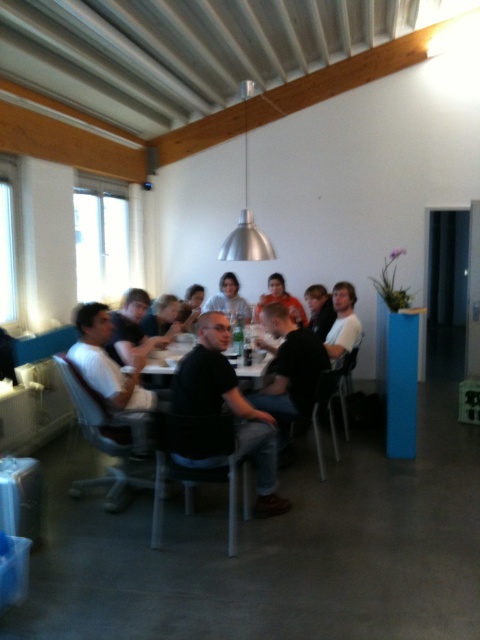
Question: Which point appears closest to the camera in this image?

Choices:
 (A) (224, 301)
 (B) (204, 413)

Answer: (B)

Question: Is black fabric chair at center positioned behind white matte shirt at center?

Choices:
 (A) no
 (B) yes

Answer: (A)

Question: Among these points, which one is nearest to the camera?

Choices:
 (A) (212, 332)
 (B) (251, 442)

Answer: (B)

Question: In this image, where is black shirt at center located relative to white matte shirt at center?

Choices:
 (A) right
 (B) left

Answer: (A)

Question: Which point is closer to the camera?

Choices:
 (A) black shirt at center
 (B) white matte shirt at center

Answer: (A)

Question: Can you confirm if black shirt at center is wider than black fabric chair at center?

Choices:
 (A) yes
 (B) no

Answer: (B)